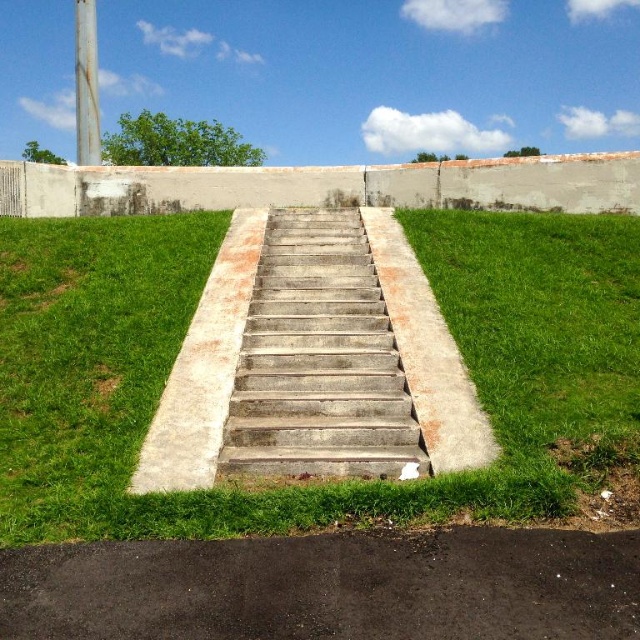
Question: Which point is closer to the camera?

Choices:
 (A) (342, 538)
 (B) (604, 420)
 (C) (282, 472)

Answer: (A)

Question: Where is green grass at center located in relation to dark gray asphalt at lower center in the image?

Choices:
 (A) right
 (B) left

Answer: (B)

Question: Considering the relative positions of green grass at center and dark gray asphalt at lower center in the image provided, where is green grass at center located with respect to dark gray asphalt at lower center?

Choices:
 (A) left
 (B) right

Answer: (A)

Question: Which of the following is the farthest from the observer?

Choices:
 (A) (100, 392)
 (B) (536, 570)

Answer: (A)

Question: Does dark gray asphalt at lower center have a greater width compared to concrete/stained stairs at center?

Choices:
 (A) no
 (B) yes

Answer: (B)

Question: Among these points, which one is nearest to the camera?

Choices:
 (A) (356, 573)
 (B) (332, 492)

Answer: (A)